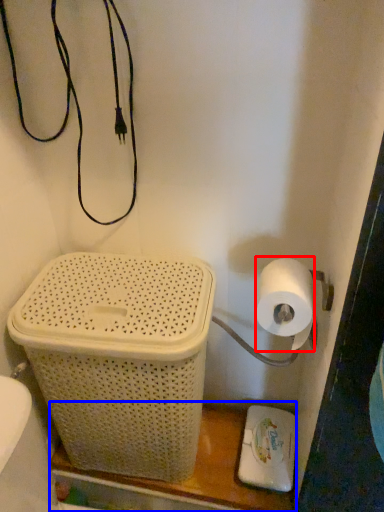
Question: Which of the following is the closest to the observer, toilet paper (highlighted by a red box) or shelf (highlighted by a blue box)?

Choices:
 (A) toilet paper
 (B) shelf

Answer: (A)